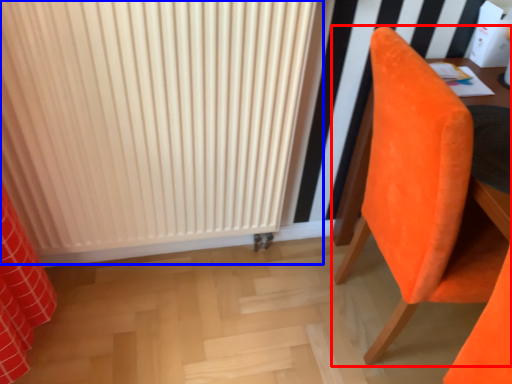
Question: Which object appears closest to the camera in this image, chair (highlighted by a red box) or radiator (highlighted by a blue box)?

Choices:
 (A) chair
 (B) radiator

Answer: (A)